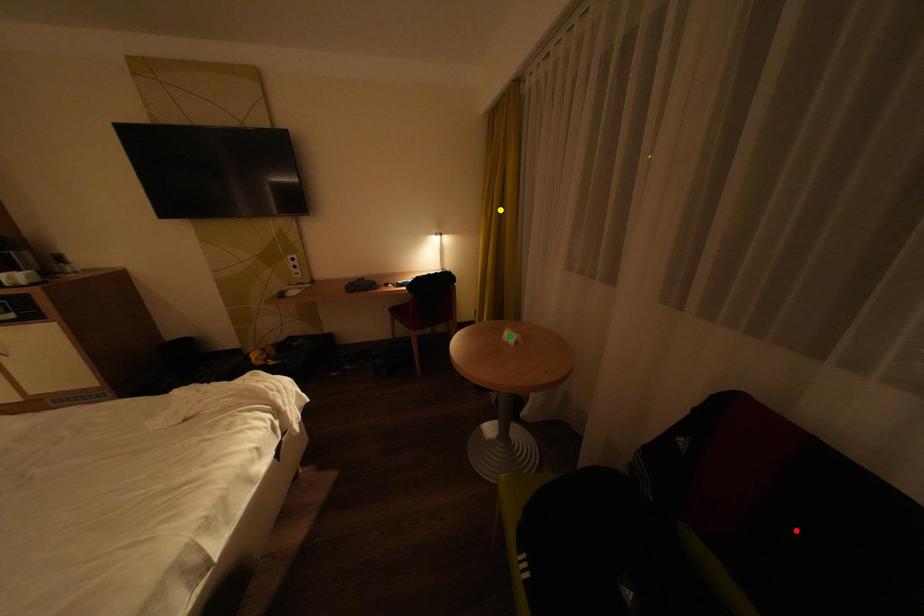
Order these from nearest to farthest:
- green point
- yellow point
- red point

yellow point → green point → red point